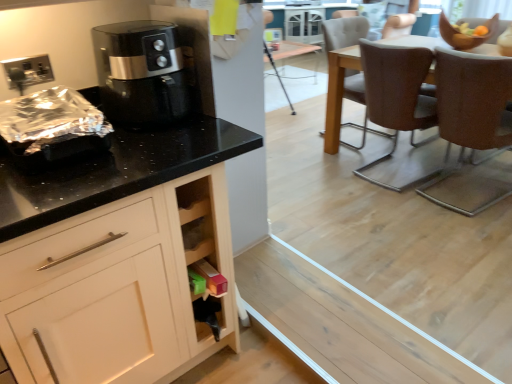
Question: Is black glossy air fryer at upper left at the left side of brown leather chair at right, positioned as the 3th chair in back-to-front order?

Choices:
 (A) yes
 (B) no

Answer: (A)

Question: Is black glossy air fryer at upper left bigger than brown leather chair at right, positioned as the 3th chair in back-to-front order?

Choices:
 (A) no
 (B) yes

Answer: (A)

Question: Is black glossy air fryer at upper left aimed at brown leather chair at right, positioned as the 3th chair in back-to-front order?

Choices:
 (A) yes
 (B) no

Answer: (B)

Question: Can you confirm if black glossy air fryer at upper left is taller than brown leather chair at right, positioned as the 3th chair in back-to-front order?

Choices:
 (A) yes
 (B) no

Answer: (B)

Question: Can you confirm if black glossy air fryer at upper left is thinner than brown leather chair at right, positioned as the 3th chair in back-to-front order?

Choices:
 (A) no
 (B) yes

Answer: (B)

Question: Are black glossy air fryer at upper left and brown leather chair at right, which is the 1th chair from front to back, located far from each other?

Choices:
 (A) yes
 (B) no

Answer: (A)

Question: Is wooden cabinet at lower center looking in the opposite direction of brown leather chair at right, which is the 1th chair from front to back?

Choices:
 (A) no
 (B) yes

Answer: (A)

Question: From a real-world perspective, is wooden cabinet at lower center physically above brown leather chair at right, which is the 1th chair from front to back?

Choices:
 (A) yes
 (B) no

Answer: (B)

Question: Considering the relative sizes of wooden cabinet at lower center and brown leather chair at right, positioned as the 3th chair in back-to-front order, in the image provided, is wooden cabinet at lower center taller than brown leather chair at right, positioned as the 3th chair in back-to-front order,?

Choices:
 (A) no
 (B) yes

Answer: (A)

Question: Is wooden cabinet at lower center next to brown leather chair at right, positioned as the 3th chair in back-to-front order?

Choices:
 (A) yes
 (B) no

Answer: (B)

Question: Does wooden cabinet at lower center have a smaller size compared to brown leather chair at right, positioned as the 3th chair in back-to-front order?

Choices:
 (A) yes
 (B) no

Answer: (A)

Question: Is wooden cabinet at lower center behind brown leather chair at right, positioned as the 3th chair in back-to-front order?

Choices:
 (A) no
 (B) yes

Answer: (A)

Question: From the image's perspective, is brown leather chair at right, which is the 1th chair from front to back, over black glossy air fryer at upper left?

Choices:
 (A) yes
 (B) no

Answer: (B)